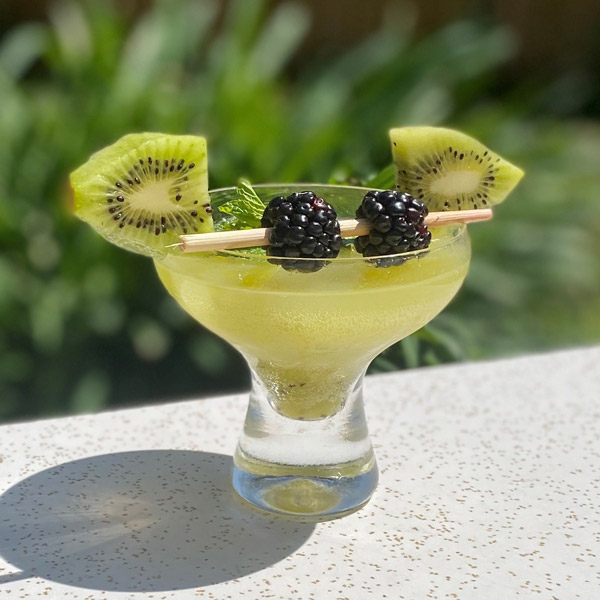
Find the location of `plants in background`. plants in background is located at coordinates (42, 138), (559, 164).